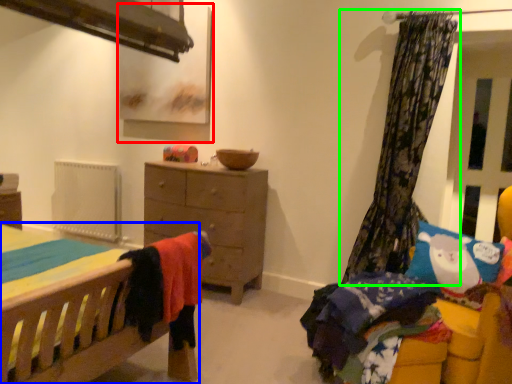
Question: Based on their relative distances, which object is farther from picture frame (highlighted by a red box)? Choose from bed (highlighted by a blue box) and curtain (highlighted by a green box).

Choices:
 (A) bed
 (B) curtain

Answer: (A)